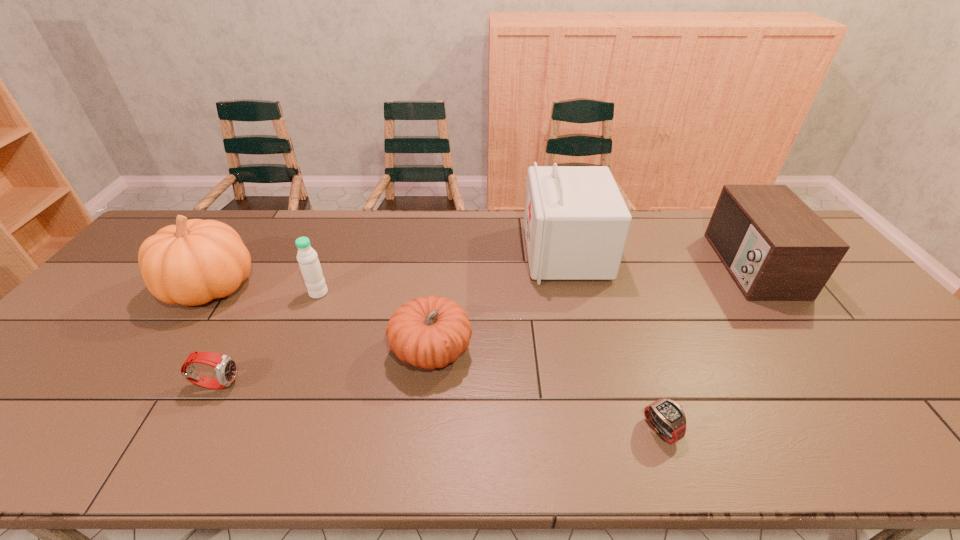
Where is `vacant space at the left edge of the desktop`? vacant space at the left edge of the desktop is located at coordinates (41, 370).

This screenshot has height=540, width=960. I want to click on vacant point at the right edge, so click(x=899, y=399).

Locate an element on the screen. The height and width of the screenshot is (540, 960). free spot between the right watch and the first-aid kit is located at coordinates [x=613, y=341].

This screenshot has width=960, height=540. I want to click on vacant space that's between the fourth object from right to left and the fifth object from right to left, so click(x=375, y=322).

This screenshot has height=540, width=960. Identify the location of free space between the right watch and the radio receiver. (706, 347).

The height and width of the screenshot is (540, 960). What are the coordinates of `empty space that is in between the right pumpkin and the first-aid kit` in the screenshot? It's located at (499, 302).

Locate an element on the screen. free spot between the fourth object from left to right and the farther watch is located at coordinates (324, 367).

Find the location of a particular element. This screenshot has height=540, width=960. vacant point located between the first-aid kit and the shorter pumpkin is located at coordinates (499, 302).

I want to click on free space between the water bottle and the taller pumpkin, so click(x=265, y=291).

Find the location of a particular element. The height and width of the screenshot is (540, 960). empty space between the shorter pumpkin and the left pumpkin is located at coordinates (322, 319).